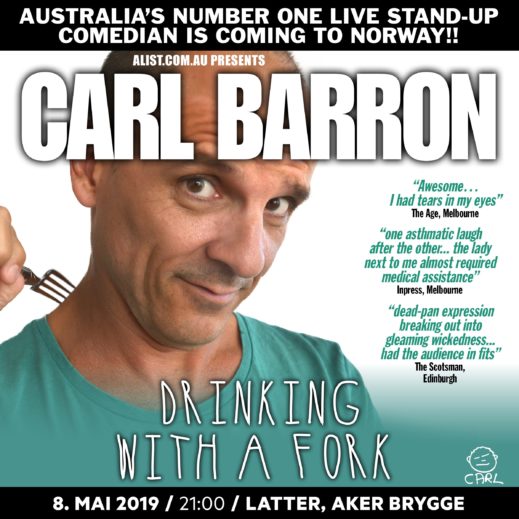
Locate an element on the screen. Image resolution: width=519 pixels, height=519 pixels. fork is located at coordinates (34, 283).